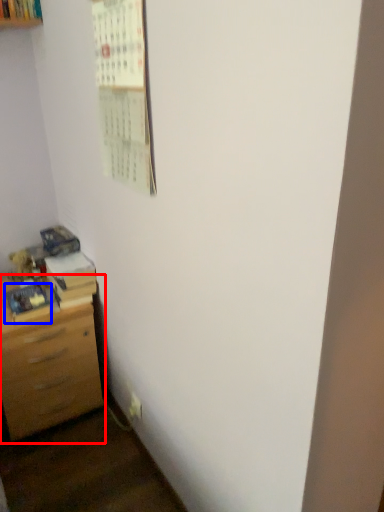
Question: Which object appears farthest to the camera in this image, chest of drawers (highlighted by a red box) or book (highlighted by a blue box)?

Choices:
 (A) chest of drawers
 (B) book

Answer: (B)